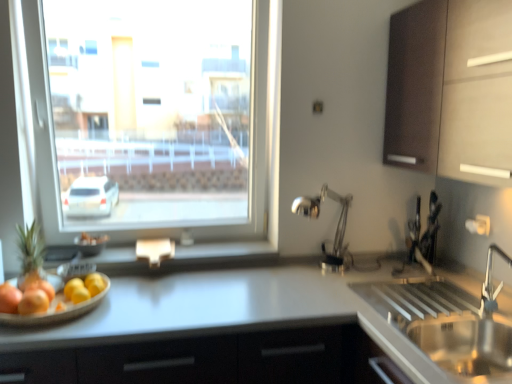
Find the location of a particular element. This screenshot has width=512, height=384. free space to the right of yellow matte lemon at lower left, the 2th fruit positioned from the left is located at coordinates (123, 309).